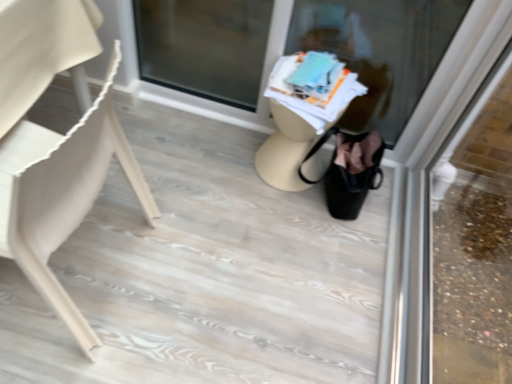
Question: Would you say transparent glass door at upper right, the 2th shop window from the left, is inside or outside matte beige chair at left?

Choices:
 (A) outside
 (B) inside

Answer: (A)

Question: From the image's perspective, is transparent glass door at upper right, the 2th shop window from the left, above or below matte beige chair at left?

Choices:
 (A) below
 (B) above

Answer: (A)

Question: Which of these objects is positioned farthest from the matte beige chair at left?

Choices:
 (A) beige matte table at center
 (B) translucent glass at center, the first shop window viewed from the left
 (C) transparent glass door at upper right, marked as the first shop window in a right-to-left arrangement

Answer: (C)

Question: Estimate the real-world distances between objects in this image. Which object is closer to the beige matte table at center?

Choices:
 (A) transparent glass door at upper right, marked as the first shop window in a right-to-left arrangement
 (B) matte beige chair at left
 (C) translucent glass at center, the first shop window viewed from the left

Answer: (C)